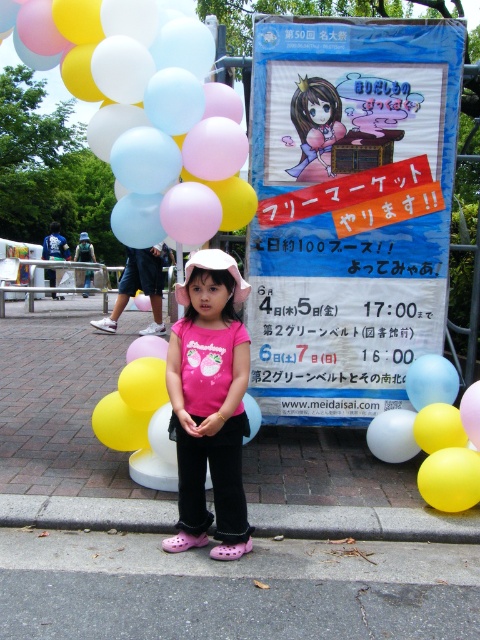
Between blue paper sign at center and gray concrete curb at lower center, which one is positioned lower?

gray concrete curb at lower center

Does blue paper sign at center have a lesser width compared to gray concrete curb at lower center?

No.

This screenshot has height=640, width=480. What do you see at coordinates (348, 209) in the screenshot?
I see `blue paper sign at center` at bounding box center [348, 209].

Where is `blue paper sign at center`? The height and width of the screenshot is (640, 480). blue paper sign at center is located at coordinates (348, 209).

Does pink matte hat at center have a smaller size compared to gray concrete curb at lower center?

No.

Is pink matte hat at center bigger than gray concrete curb at lower center?

Indeed, pink matte hat at center has a larger size compared to gray concrete curb at lower center.

Measure the distance between point (189, 307) and camera.

Point (189, 307) and camera are 3.37 meters apart.

I want to click on pink matte hat at center, so (210, 404).

Is matte balloons at center thinner than pink matte hat at center?

No.

Does point (134, 113) lie behind point (248, 428)?

Yes, it is behind point (248, 428).

Image resolution: width=480 pixels, height=640 pixels. Identify the location of matte balloons at center. pyautogui.click(x=145, y=108).